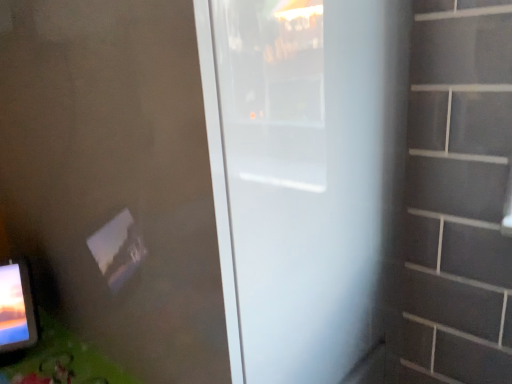
Question: Does white matte door at center lie in front of green matte table at lower left?

Choices:
 (A) no
 (B) yes

Answer: (B)

Question: Considering the relative sizes of white matte door at center and green matte table at lower left in the image provided, is white matte door at center shorter than green matte table at lower left?

Choices:
 (A) no
 (B) yes

Answer: (A)

Question: Is white matte door at center oriented away from green matte table at lower left?

Choices:
 (A) yes
 (B) no

Answer: (B)

Question: Is white matte door at center to the right of green matte table at lower left from the viewer's perspective?

Choices:
 (A) no
 (B) yes

Answer: (B)

Question: Considering the relative sizes of white matte door at center and green matte table at lower left in the image provided, is white matte door at center thinner than green matte table at lower left?

Choices:
 (A) yes
 (B) no

Answer: (B)

Question: Is white matte door at center not near green matte table at lower left?

Choices:
 (A) yes
 (B) no

Answer: (B)

Question: Is green matte table at lower left not inside white matte door at center?

Choices:
 (A) yes
 (B) no

Answer: (A)

Question: Is green matte table at lower left looking in the opposite direction of white matte door at center?

Choices:
 (A) no
 (B) yes

Answer: (A)

Question: From a real-world perspective, is green matte table at lower left positioned over white matte door at center based on gravity?

Choices:
 (A) yes
 (B) no

Answer: (B)

Question: Is the depth of green matte table at lower left greater than that of white matte door at center?

Choices:
 (A) yes
 (B) no

Answer: (A)

Question: From the image's perspective, would you say green matte table at lower left is positioned over white matte door at center?

Choices:
 (A) no
 (B) yes

Answer: (A)

Question: Considering the relative positions of green matte table at lower left and white matte door at center in the image provided, is green matte table at lower left to the right of white matte door at center from the viewer's perspective?

Choices:
 (A) yes
 (B) no

Answer: (B)

Question: In terms of size, does white matte door at center appear bigger or smaller than green matte table at lower left?

Choices:
 (A) big
 (B) small

Answer: (A)